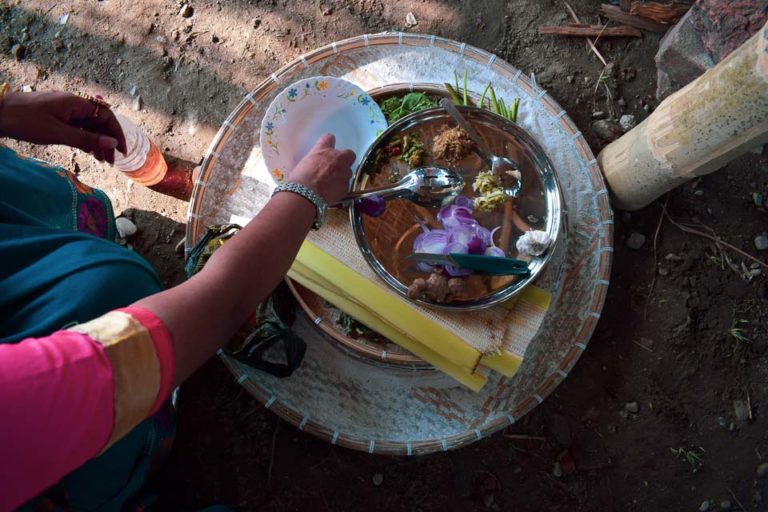
Find the location of `tray`. tray is located at coordinates (315, 308).